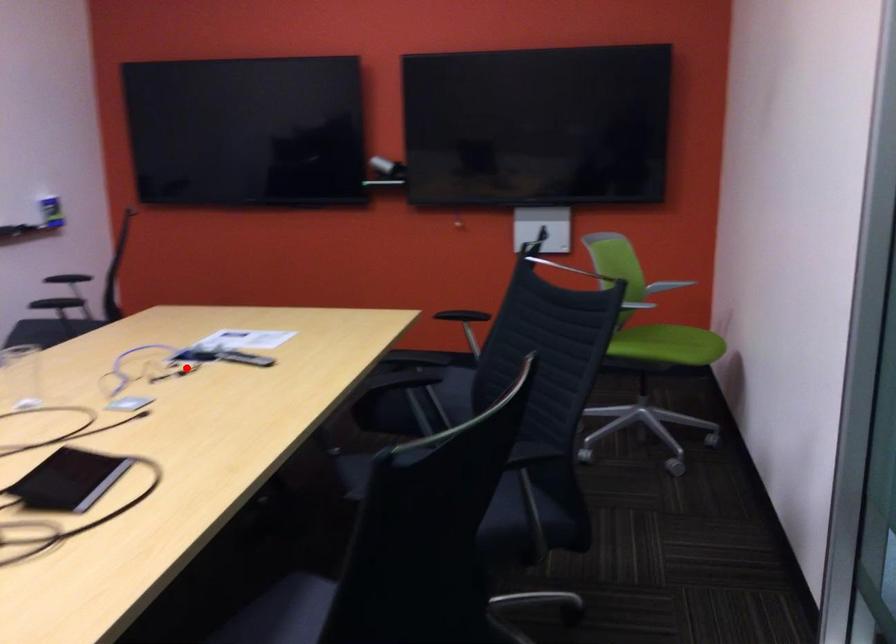
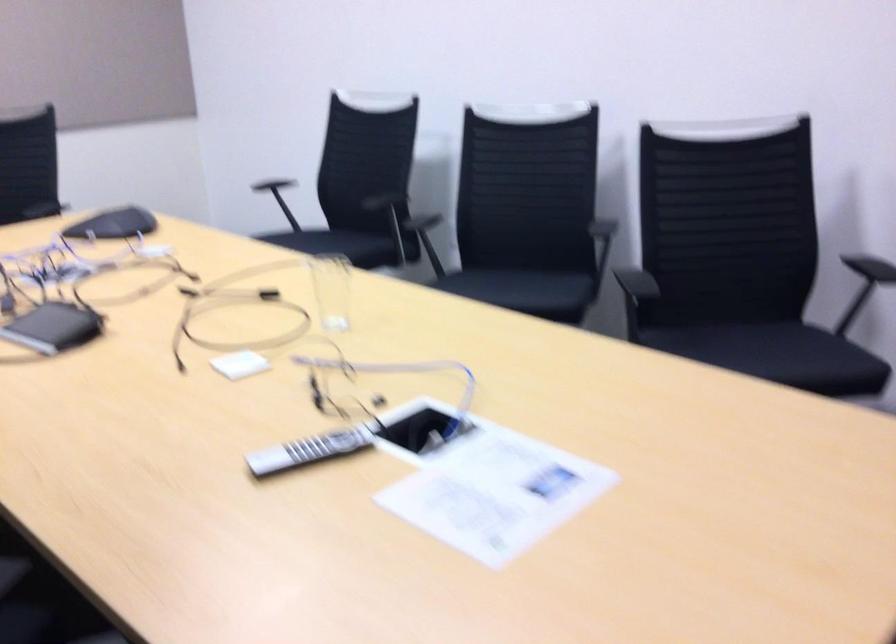
Question: I am providing you with two images of the same scene from different viewpoints. Image1 has a red point marked. In image2, the corresponding 3D location appears at what relative position? Reply with the corresponding letter.

Choices:
 (A) Closer
 (B) Farther

Answer: (A)